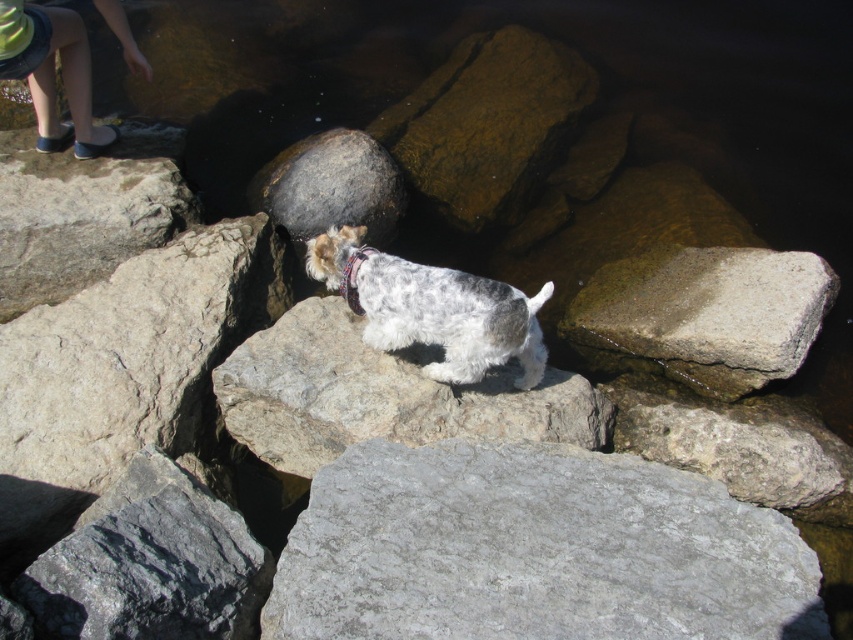
Question: Which point is farther from the camera taking this photo?

Choices:
 (A) click(119, 193)
 (B) click(589, 86)
 (C) click(804, 280)
 (D) click(90, 538)

Answer: (B)

Question: Does gray rough stone at center come behind brown rough rock at center?

Choices:
 (A) no
 (B) yes

Answer: (A)

Question: Does gray rough rock at upper left have a greater width compared to dark gray stone boulder at center?

Choices:
 (A) no
 (B) yes

Answer: (B)

Question: Where is gray rough rock at center located in relation to dark gray stone boulder at center in the image?

Choices:
 (A) above
 (B) below

Answer: (B)

Question: Which point is farther from the camera taking this photo?

Choices:
 (A) (419, 88)
 (B) (589, 548)
 (C) (305, 221)

Answer: (A)

Question: Among these objects, which one is nearest to the camera?

Choices:
 (A) speckled fur dog at center
 (B) gray rough stone at center

Answer: (B)